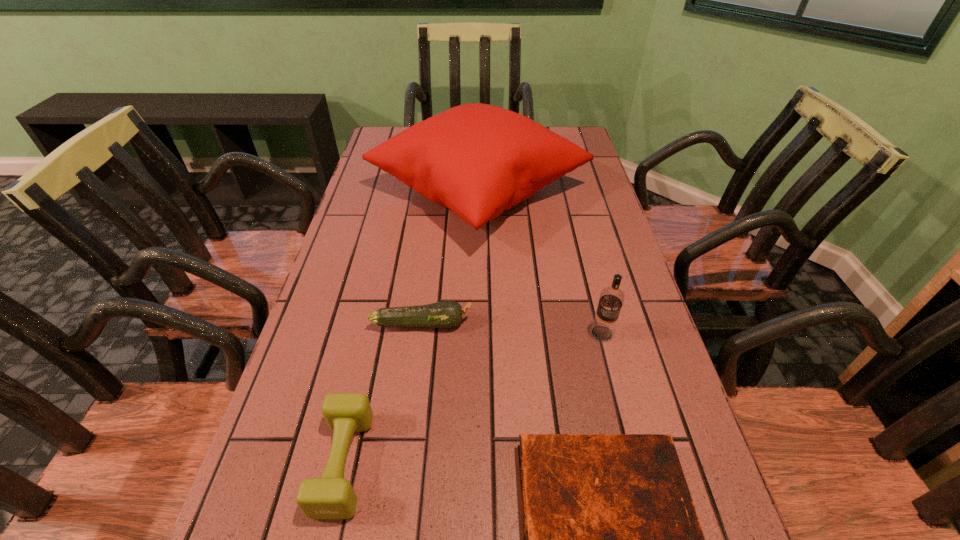
Locate an element on the screen. the tallest object is located at coordinates (476, 159).

The width and height of the screenshot is (960, 540). Identify the location of cushion. [x=476, y=159].

Where is `the fourth shortest object`? The width and height of the screenshot is (960, 540). the fourth shortest object is located at coordinates (611, 299).

Where is `dumbbell`? dumbbell is located at coordinates (331, 496).

You are a GUI agent. You are given a task and a screenshot of the screen. Output one action in this format:
    pyautogui.click(x=<x>, y=<y>)
    Task: Click on the zucchini
    
    Given the screenshot: What is the action you would take?
    pyautogui.click(x=446, y=314)

Find the location of `vacant space positioned 0.260m on the front of the farthest object`. vacant space positioned 0.260m on the front of the farthest object is located at coordinates (477, 347).

Image resolution: width=960 pixels, height=540 pixels. Identify the location of vacant region located 0.120m on the label of the second tallest object. (617, 394).

Find the location of a particular element. This screenshot has height=540, width=960. free location located 0.220m on the back of the dumbbell is located at coordinates (375, 321).

Identify the location of free spot located at the blossom end of the second shortest object. (584, 323).

Find the location of a particular element. The image size is (960, 540). object that is at the far edge is located at coordinates (476, 159).